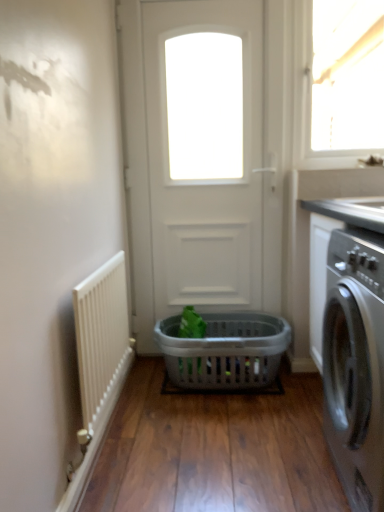
Question: Is transparent glass window at upper right shorter than white matte door at center?

Choices:
 (A) yes
 (B) no

Answer: (A)

Question: Considering the relative sizes of transparent glass window at upper right and white matte door at center in the image provided, is transparent glass window at upper right smaller than white matte door at center?

Choices:
 (A) no
 (B) yes

Answer: (B)

Question: Does transparent glass window at upper right appear on the right side of white matte door at center?

Choices:
 (A) no
 (B) yes

Answer: (B)

Question: Does transparent glass window at upper right have a greater width compared to white matte door at center?

Choices:
 (A) yes
 (B) no

Answer: (B)

Question: Considering the relative positions of transparent glass window at upper right and white matte door at center in the image provided, is transparent glass window at upper right behind white matte door at center?

Choices:
 (A) yes
 (B) no

Answer: (A)

Question: Is white matte door at center surrounded by transparent glass window at upper right?

Choices:
 (A) no
 (B) yes

Answer: (A)

Question: Can you confirm if white textured radiator at left is bigger than gray plastic basket at center?

Choices:
 (A) no
 (B) yes

Answer: (A)

Question: Is white textured radiator at left at the left side of gray plastic basket at center?

Choices:
 (A) no
 (B) yes

Answer: (B)

Question: From a real-world perspective, is white textured radiator at left physically above gray plastic basket at center?

Choices:
 (A) no
 (B) yes

Answer: (B)

Question: Considering the relative sizes of white textured radiator at left and gray plastic basket at center in the image provided, is white textured radiator at left shorter than gray plastic basket at center?

Choices:
 (A) no
 (B) yes

Answer: (A)

Question: From a real-world perspective, is white textured radiator at left physically below gray plastic basket at center?

Choices:
 (A) no
 (B) yes

Answer: (A)

Question: Is white textured radiator at left outside gray plastic basket at center?

Choices:
 (A) yes
 (B) no

Answer: (A)

Question: Does satin black washing machine at right have a larger size compared to white textured radiator at left?

Choices:
 (A) no
 (B) yes

Answer: (B)